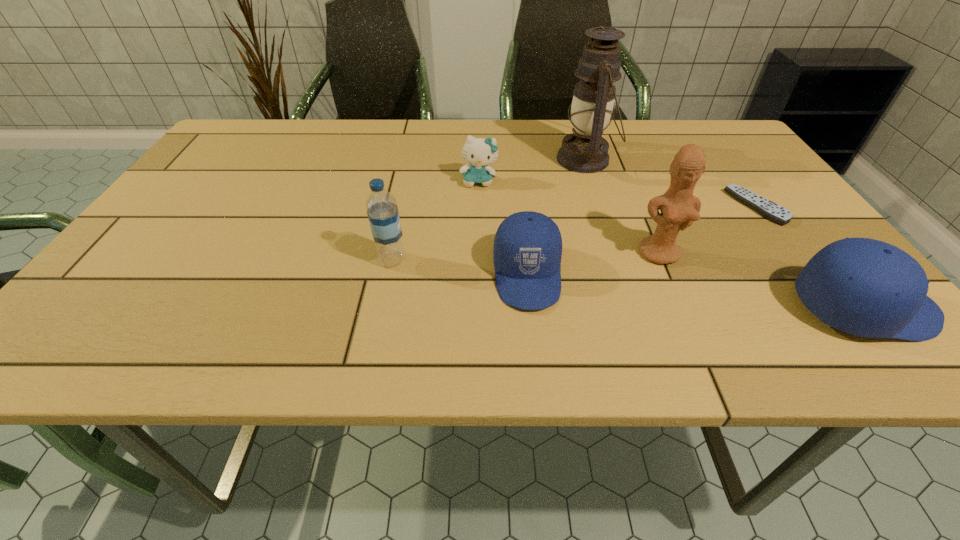
At what (x,y) coordinates should I click in order to perform the action: click on free point between the shorter cap and the third tallest object. Please return your answer as a coordinate pair (x, y). The height and width of the screenshot is (540, 960). Looking at the image, I should click on (460, 267).

At what (x,y) coordinates should I click in order to perform the action: click on vacant space that is in between the shorter cap and the tallest object. Please return your answer as a coordinate pair (x, y). The image size is (960, 540). Looking at the image, I should click on (557, 217).

This screenshot has width=960, height=540. I want to click on free point between the tallest object and the second tallest object, so click(x=623, y=206).

Find the location of a particular element. This screenshot has height=540, width=960. unoccupied area between the oil lamp and the shorter cap is located at coordinates (557, 217).

Locate an element on the screen. Image resolution: width=960 pixels, height=540 pixels. free spot between the shortest object and the kitten is located at coordinates (618, 194).

Locate an element on the screen. free spot between the third tallest object and the kitten is located at coordinates (436, 221).

Locate which object is the closest to the tallest object. Please provide its 2D coordinates. Your answer should be formatted as a tuple, i.e. [(x, y)], where the tuple contains the x and y coordinates of a point satisfying the conditions above.

[(478, 152)]

Locate which object is the fifth closest to the tallest object. Please provide its 2D coordinates. Your answer should be formatted as a tuple, i.e. [(x, y)], where the tuple contains the x and y coordinates of a point satisfying the conditions above.

[(868, 288)]

You are a GUI agent. You are given a task and a screenshot of the screen. Output one action in this format:
    pyautogui.click(x=<x>, y=<y>)
    Task: Click on the vacant space that satisfies the following two spatial constraints: 1. on the face of the kitten; 2. on the left side of the shortest object
    
    Given the screenshot: What is the action you would take?
    pyautogui.click(x=479, y=207)

You are a GUI agent. You are given a task and a screenshot of the screen. Output one action in this format:
    pyautogui.click(x=<x>, y=<y>)
    Task: Click on the vacant region that satisfies the following two spatial constraints: 1. on the front side of the remote control; 2. on the left side of the oil lamp
    
    Given the screenshot: What is the action you would take?
    pyautogui.click(x=601, y=207)